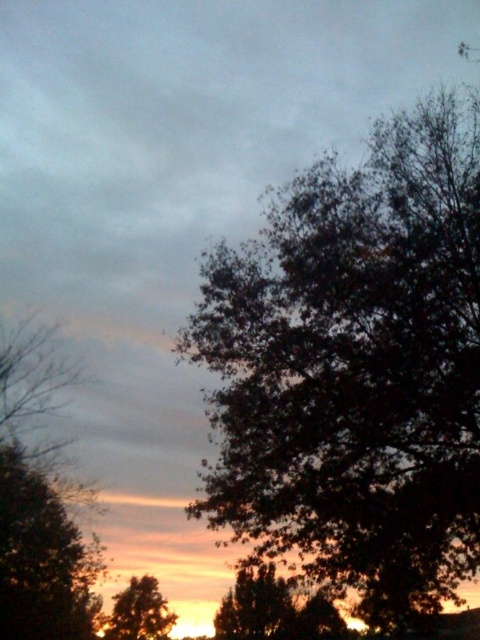
Question: Which point appears closest to the camera in this image?

Choices:
 (A) (147, 605)
 (B) (412, 305)

Answer: (B)

Question: Observing the image, what is the correct spatial positioning of dark green leafy tree at right in reference to brown textured tree at lower left?

Choices:
 (A) above
 (B) below

Answer: (A)

Question: Which point is farther to the camera?

Choices:
 (A) dark green leafy tree at right
 (B) brown textured tree at lower left

Answer: (B)

Question: Among these objects, which one is nearest to the camera?

Choices:
 (A) dark green leafy tree at right
 (B) brown textured tree at lower left

Answer: (A)

Question: Where is dark green leafy tree at right located in relation to brown textured tree at lower left in the image?

Choices:
 (A) left
 (B) right

Answer: (B)

Question: Does dark green leafy tree at right have a lesser width compared to brown textured tree at lower left?

Choices:
 (A) yes
 (B) no

Answer: (B)